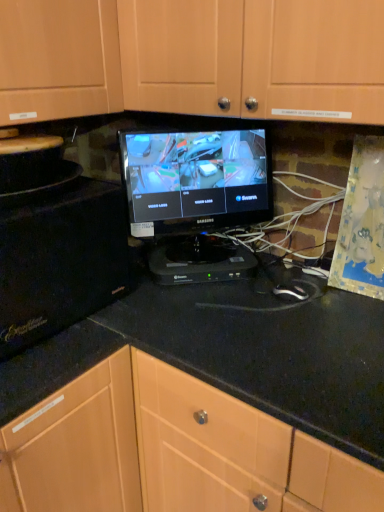
Question: Is black plastic device at center, which is the first appliance in right-to-left order, taller or shorter than black glossy monitor at center?

Choices:
 (A) short
 (B) tall

Answer: (A)

Question: From a real-world perspective, is black plastic device at center, arranged as the 2th appliance when viewed from the left, above or below black glossy monitor at center?

Choices:
 (A) below
 (B) above

Answer: (A)

Question: Estimate the real-world distances between objects in this image. Which object is closer to the black plastic mouse at center?

Choices:
 (A) black matte microwave at left, arranged as the second appliance when viewed from the right
 (B) black plastic device at center, arranged as the 2th appliance when viewed from the left
 (C) wooden cabinet at upper center
 (D) black glossy monitor at center
 (E) black granite countertop at center

Answer: (B)

Question: Estimate the real-world distances between objects in this image. Which object is farther from the wooden cabinet at upper center?

Choices:
 (A) black glossy monitor at center
 (B) black plastic device at center, which is the first appliance in right-to-left order
 (C) black granite countertop at center
 (D) black matte microwave at left, arranged as the second appliance when viewed from the right
 (E) black plastic mouse at center

Answer: (E)